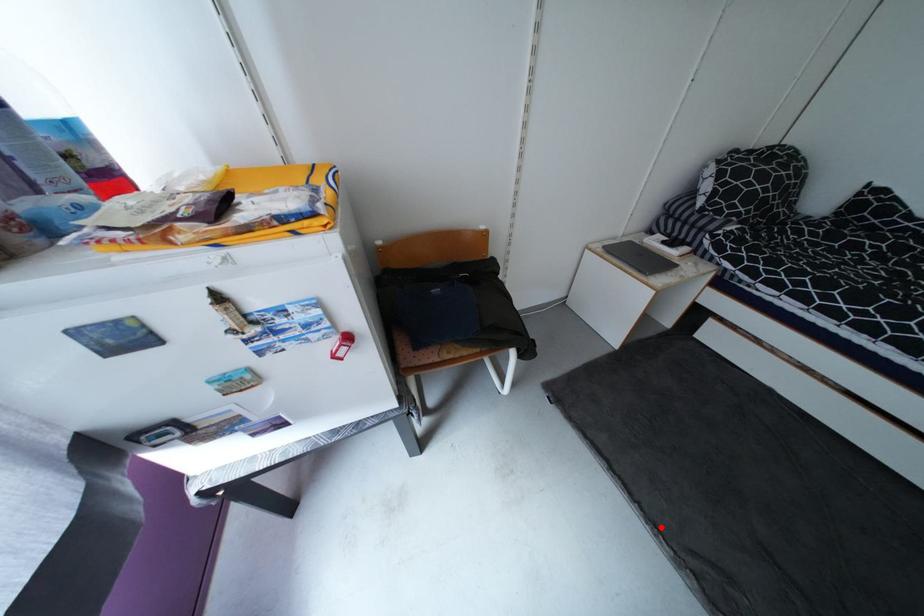
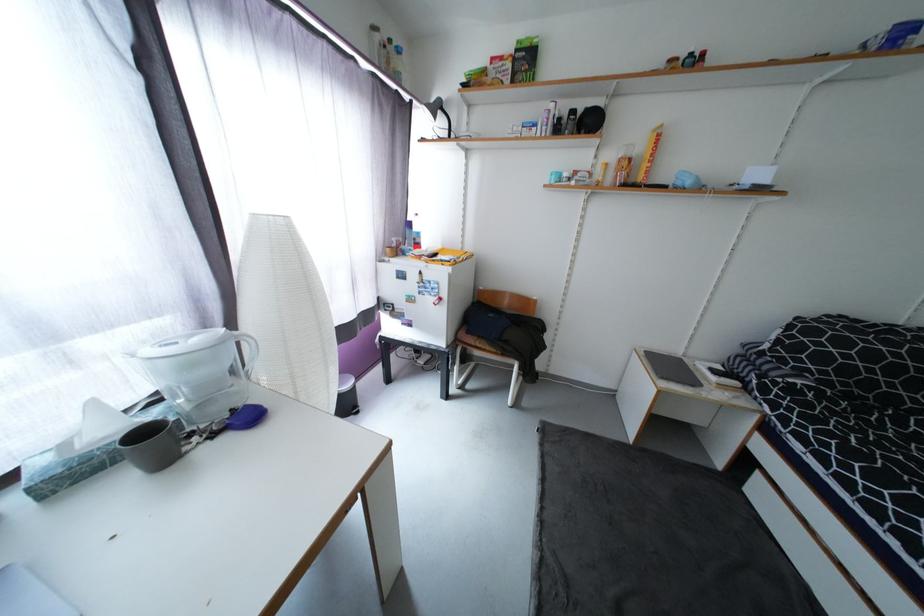
In the second image, find the point that corresponds to the highlighted location in the first image.

(548, 524)